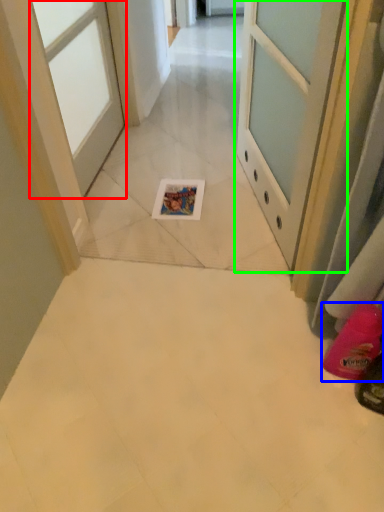
Question: Which object is the closest to the door (highlighted by a red box)? Choose among these: footwear (highlighted by a blue box) or door (highlighted by a green box).

Choices:
 (A) footwear
 (B) door

Answer: (B)